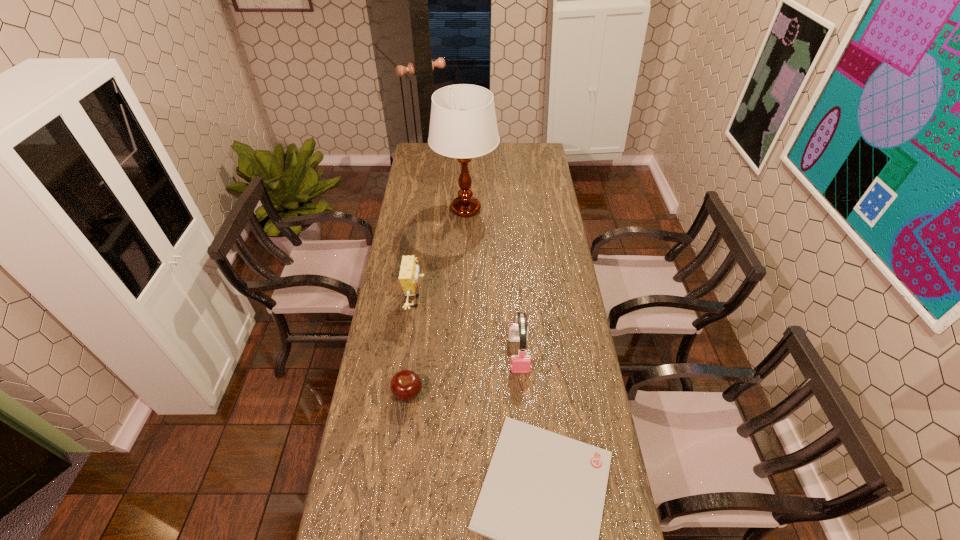
Locate an element on the screen. The height and width of the screenshot is (540, 960). table lamp is located at coordinates (463, 125).

At what (x,y) coordinates should I click in order to perform the action: click on the tallest object. Please return your answer as a coordinate pair (x, y). The height and width of the screenshot is (540, 960). Looking at the image, I should click on (463, 125).

Identify the location of sponge. This screenshot has width=960, height=540. (408, 275).

You are a GUI agent. You are given a task and a screenshot of the screen. Output one action in this format:
    pyautogui.click(x=<x>, y=<y>)
    Task: Click on the third farthest object
    Image resolution: width=960 pixels, height=540 pixels.
    Given the screenshot: What is the action you would take?
    pyautogui.click(x=521, y=363)

In order to click on the fourth tallest object in this screenshot , I will do `click(406, 385)`.

In order to click on the fourth farthest object in this screenshot , I will do `click(406, 385)`.

The width and height of the screenshot is (960, 540). I want to click on free spot located on the back of the tallest object, so click(468, 170).

The width and height of the screenshot is (960, 540). Identify the location of vacant region located 0.160m on the face of the sponge. (469, 301).

Identify the location of vacant point located 0.370m on the outer surface of the earphone. Image resolution: width=960 pixels, height=540 pixels. (529, 491).

Locate an element on the screen. Image resolution: width=960 pixels, height=540 pixels. vacant space located 0.340m on the front of the second nearest object is located at coordinates (391, 529).